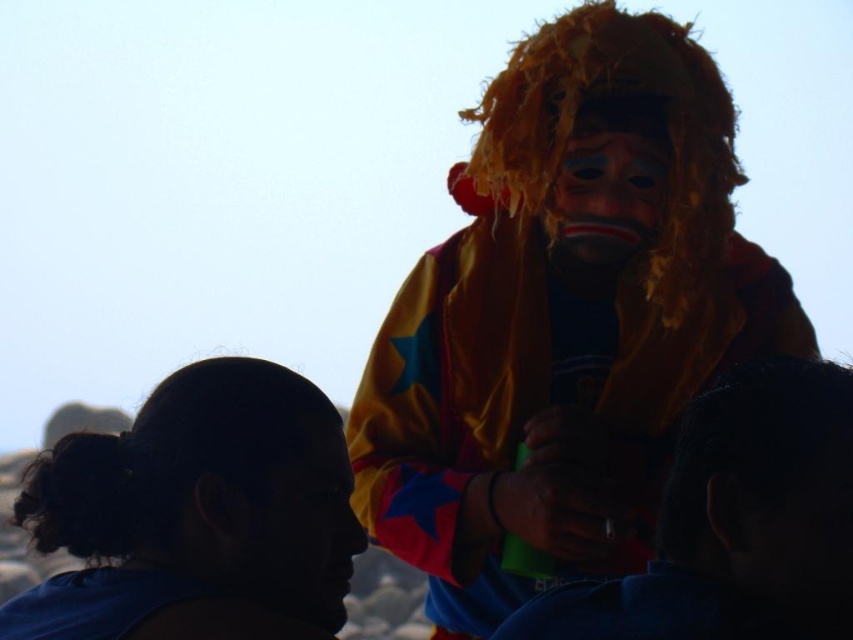
Looking at this image, you are a photographer at an event and need to capture a clear shot of both the yellow fabric lion mask at upper right and the matte plastic mask at center. Based on their positions, which mask is closer to the camera?

The matte plastic mask at center is closer to the camera because the yellow fabric lion mask at upper right is positioned under it, indicating it is behind.

You are a photographer trying to capture the interaction between the two figures in the scene. You notice the silky fabric shirt at center and the matte plastic mask at center. Which object should you focus on first if you want to highlight the one that is more to the right?

The silky fabric shirt at center should be focused on first because it is positioned on the right side of the matte plastic mask at center, making it the object more to the right.